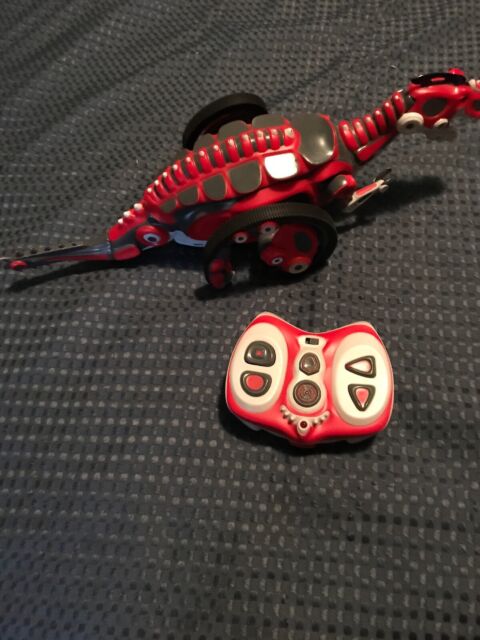
I want to click on blanket, so click(x=258, y=523).